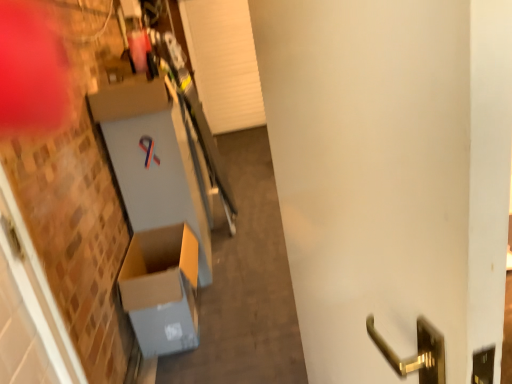
In order to click on empty space that is to the right of brown cardboard box at lower left in this screenshot , I will do `click(242, 313)`.